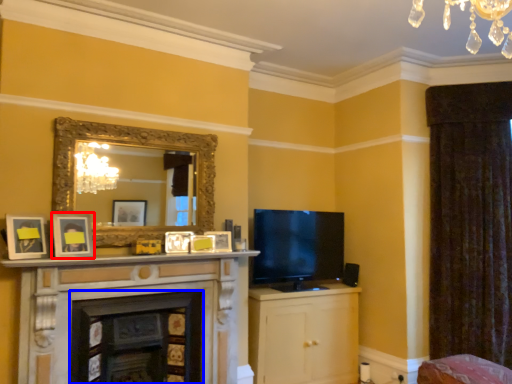
Question: Which point is closer to the camera, picture frame (highlighted by a red box) or fireplace (highlighted by a blue box)?

Choices:
 (A) picture frame
 (B) fireplace

Answer: (A)